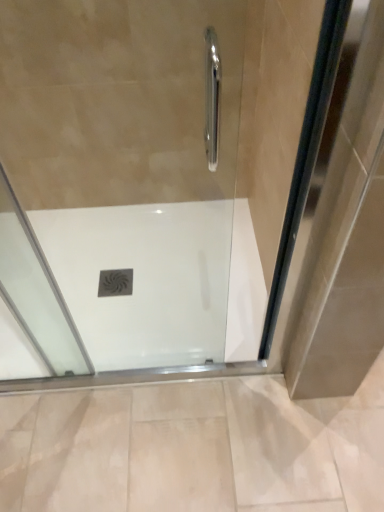
The image size is (384, 512). Find the location of `clear glass door at center`. clear glass door at center is located at coordinates (119, 178).

The image size is (384, 512). Describe the element at coordinates (119, 178) in the screenshot. I see `clear glass door at center` at that location.

At what (x,y) coordinates should I click in order to perform the action: click on clear glass door at center. Please return your answer as a coordinate pair (x, y). Image resolution: width=384 pixels, height=512 pixels. Looking at the image, I should click on (119, 178).